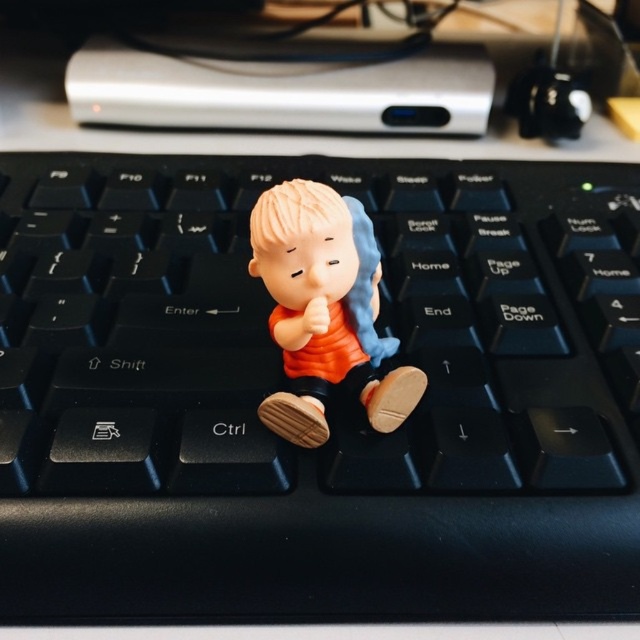
Question: Is the position of black plastic keyboard at center more distant than that of matte orange figurine at center?

Choices:
 (A) no
 (B) yes

Answer: (B)

Question: Can you confirm if black plastic keyboard at center is positioned to the right of matte orange figurine at center?

Choices:
 (A) no
 (B) yes

Answer: (A)

Question: Which of the following is the closest to the observer?

Choices:
 (A) matte orange figurine at center
 (B) black plastic keyboard at center

Answer: (A)

Question: Which of the following is the farthest from the observer?

Choices:
 (A) black plastic keyboard at center
 (B) matte orange figurine at center

Answer: (A)

Question: Can you confirm if black plastic keyboard at center is wider than matte orange figurine at center?

Choices:
 (A) yes
 (B) no

Answer: (A)